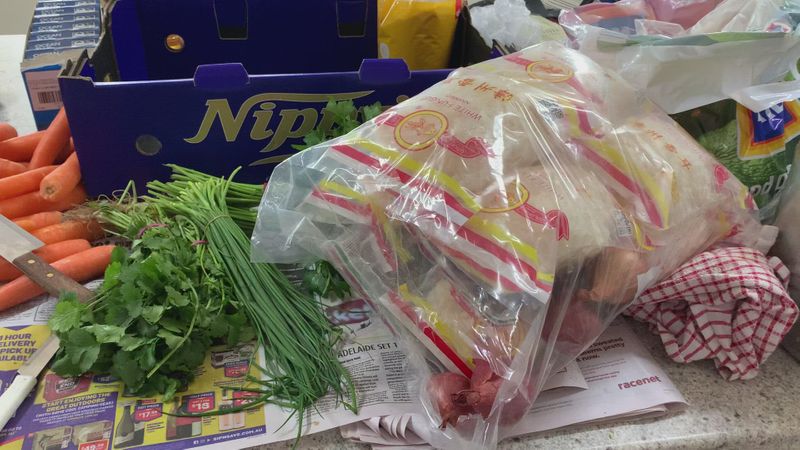
Identify the location of marble tapletop. Image resolution: width=800 pixels, height=450 pixels. (773, 408), (666, 447).